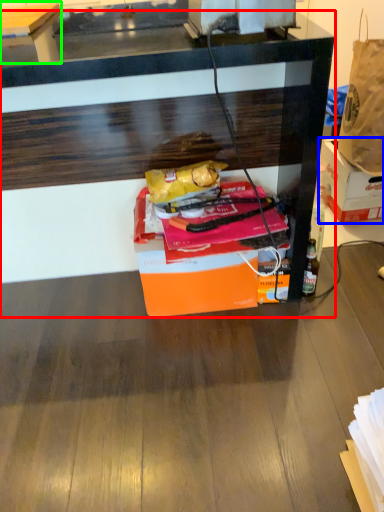
Question: Based on their relative distances, which object is farther from desk (highlighted by a red box)? Choose from box (highlighted by a blue box) and table (highlighted by a green box).

Choices:
 (A) box
 (B) table

Answer: (B)